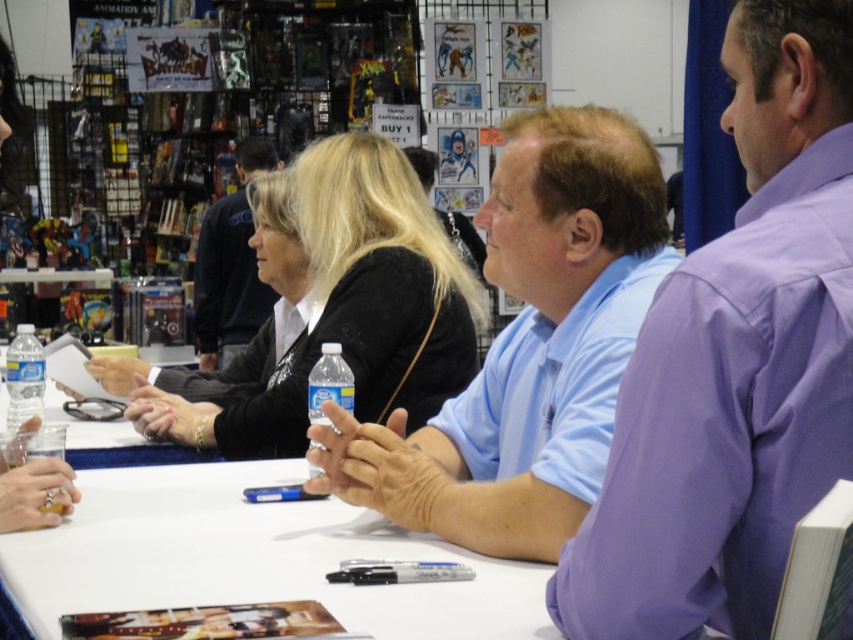
Between clear plastic water bottle at left and clear plastic water bottle at center, which one is positioned higher?

clear plastic water bottle at center

Between clear plastic water bottle at left and clear plastic water bottle at center, which one is positioned lower?

clear plastic water bottle at left

Who is more distant from viewer, [39,376] or [320,417]?

Point [39,376]

This screenshot has height=640, width=853. What are the coordinates of `clear plastic water bottle at left` in the screenshot? It's located at (24, 378).

Can you confirm if purple cotton shirt at right is positioned to the right of light blue shirt at center?

Correct, you'll find purple cotton shirt at right to the right of light blue shirt at center.

Is point (849, 32) closer to viewer compared to point (614, 164)?

Yes, point (849, 32) is closer to viewer.

Where is `purple cotton shirt at right`? purple cotton shirt at right is located at coordinates (735, 364).

Locate an element on the screen. purple cotton shirt at right is located at coordinates (735, 364).

Is white paper at center above clear plastic water bottle at left?

Actually, white paper at center is below clear plastic water bottle at left.

Can you confirm if white paper at center is bigger than clear plastic water bottle at left?

Correct, white paper at center is larger in size than clear plastic water bottle at left.

This screenshot has width=853, height=640. I want to click on white paper at center, so click(252, 557).